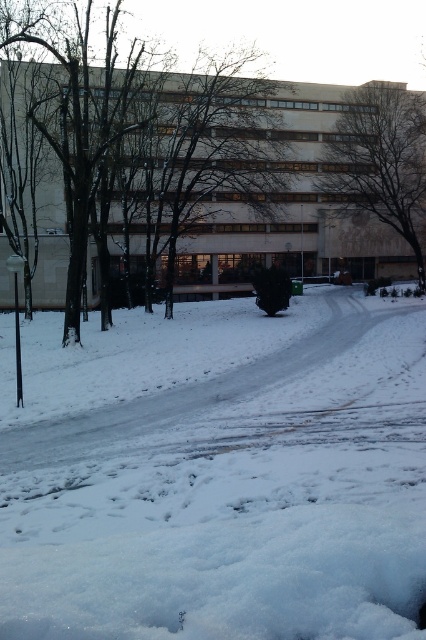
Question: Can you confirm if white fluffy snow at center is positioned to the left of brown textured tree at upper center?

Choices:
 (A) no
 (B) yes

Answer: (B)

Question: Which of these objects is positioned farthest from the brown textured tree at upper center?

Choices:
 (A) white fluffy snow at center
 (B) brown leafless tree at left

Answer: (A)

Question: Which of these objects is positioned closest to the brown textured tree at upper center?

Choices:
 (A) brown leafless tree at left
 (B) white fluffy snow at center

Answer: (A)

Question: Does brown leafless tree at left have a smaller size compared to brown textured tree at upper center?

Choices:
 (A) no
 (B) yes

Answer: (A)

Question: Is brown leafless tree at left above brown textured tree at upper center?

Choices:
 (A) yes
 (B) no

Answer: (A)

Question: Which object appears closest to the camera in this image?

Choices:
 (A) white fluffy snow at center
 (B) brown textured tree at upper center
 (C) brown leafless tree at left

Answer: (A)